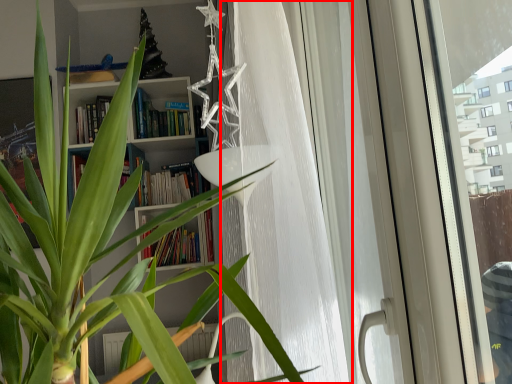
Question: From the image's perspective, what is the correct spatial relationship of curtain (annotated by the red box) in relation to screen door?

Choices:
 (A) above
 (B) below

Answer: (A)